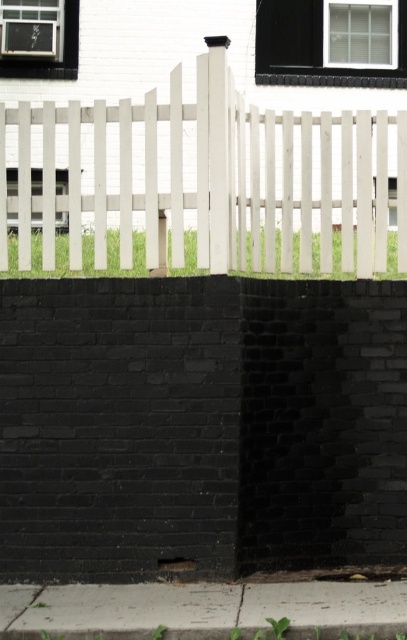
Question: Which object is closer to the camera taking this photo?

Choices:
 (A) white wood fence at center
 (B) gray concrete pavement at lower center

Answer: (B)

Question: Which object appears closest to the camera in this image?

Choices:
 (A) white wood fence at center
 (B) gray concrete pavement at lower center

Answer: (B)

Question: Observing the image, what is the correct spatial positioning of white wood fence at center in reference to gray concrete pavement at lower center?

Choices:
 (A) below
 (B) above

Answer: (B)

Question: Can you confirm if white wood fence at center is smaller than gray concrete pavement at lower center?

Choices:
 (A) no
 (B) yes

Answer: (A)

Question: Is the position of white wood fence at center more distant than that of gray concrete pavement at lower center?

Choices:
 (A) yes
 (B) no

Answer: (A)

Question: Among these points, which one is nearest to the camera?

Choices:
 (A) (266, 120)
 (B) (352, 612)

Answer: (B)